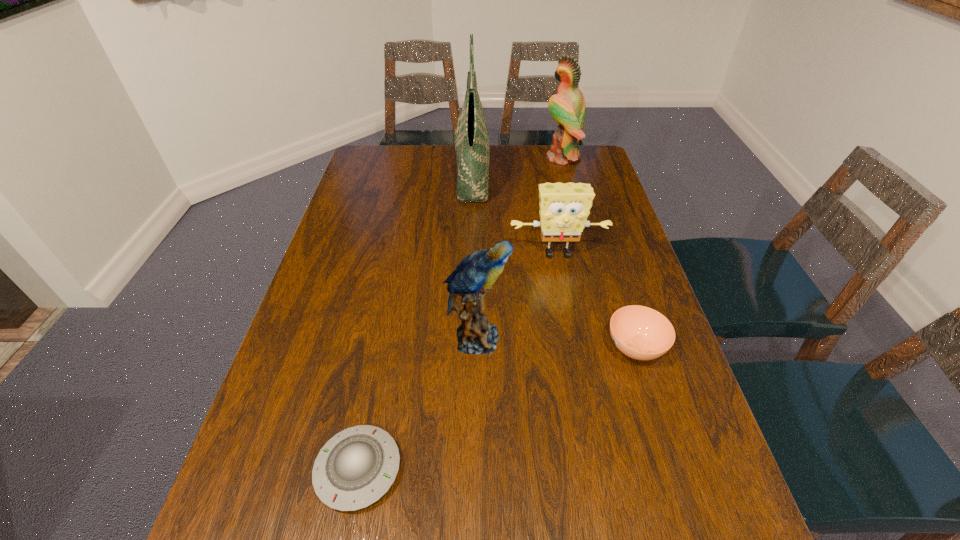
Where is `object located in the left edge section of the desktop`? object located in the left edge section of the desktop is located at coordinates (355, 468).

You are a GUI agent. You are given a task and a screenshot of the screen. Output one action in this format:
    pyautogui.click(x=<x>, y=<y>)
    Task: Click on the parrot that is at the right edge
    The width and height of the screenshot is (960, 540).
    Given the screenshot: What is the action you would take?
    pyautogui.click(x=567, y=107)

Where is `sponge present at the right edge`? This screenshot has width=960, height=540. sponge present at the right edge is located at coordinates (564, 208).

Locate an element on the screen. The height and width of the screenshot is (540, 960). soup bowl that is at the right edge is located at coordinates (641, 333).

Identify the location of object located at the far right corner. The height and width of the screenshot is (540, 960). (567, 107).

Where is `vacant region at the far edge of the desktop`? vacant region at the far edge of the desktop is located at coordinates (509, 172).

Identify the location of vacant position at the left edge of the desktop. Image resolution: width=960 pixels, height=540 pixels. (273, 388).

Locate an element on the screen. This screenshot has height=540, width=960. free space at the right edge is located at coordinates (651, 415).

Find the location of a particular element. vacant point located between the nearer parrot and the shortest object is located at coordinates (418, 404).

Where is `vacant space that is in between the right parrot and the nearer parrot`? vacant space that is in between the right parrot and the nearer parrot is located at coordinates (519, 248).